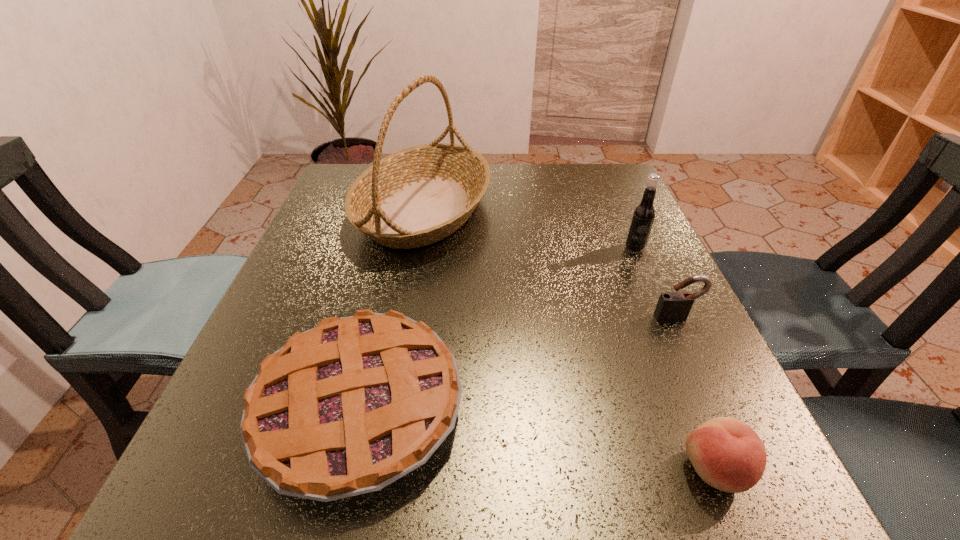
The width and height of the screenshot is (960, 540). I want to click on basket, so click(420, 195).

Where is `root beer`? The width and height of the screenshot is (960, 540). root beer is located at coordinates (644, 213).

Locate an element on the screen. The image size is (960, 540). the third farthest object is located at coordinates (672, 306).

Locate an element on the screen. The image size is (960, 540). padlock is located at coordinates (672, 306).

At what (x,y) coordinates should I click in order to perform the action: click on peach. Please return your answer as a coordinate pair (x, y). Looking at the image, I should click on (727, 454).

The width and height of the screenshot is (960, 540). What are the coordinates of `the shortest object` in the screenshot? It's located at (346, 408).

This screenshot has width=960, height=540. What are the coordinates of `vacant area situated 0.150m on the front of the basket` in the screenshot? It's located at (404, 321).

Locate an element on the screen. This screenshot has width=960, height=540. free region located on the label of the root beer is located at coordinates (655, 295).

Find the location of a particular element. free region located with the keyhole on the front of the third shortest object is located at coordinates (758, 496).

The image size is (960, 540). I want to click on blank space located 0.170m on the back of the peach, so click(663, 341).